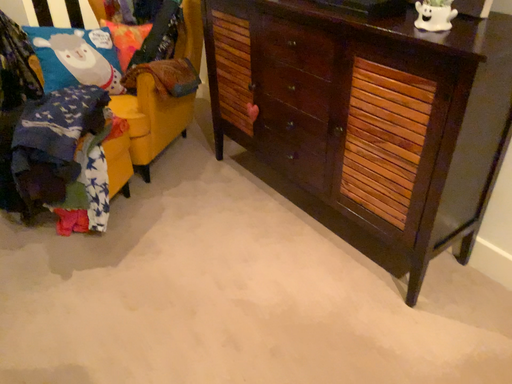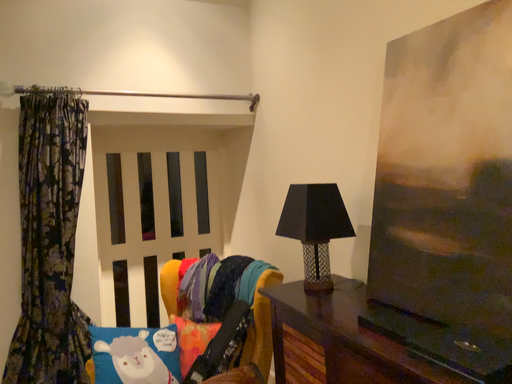
Question: Which way did the camera rotate in the video?

Choices:
 (A) rotated left
 (B) rotated right

Answer: (A)